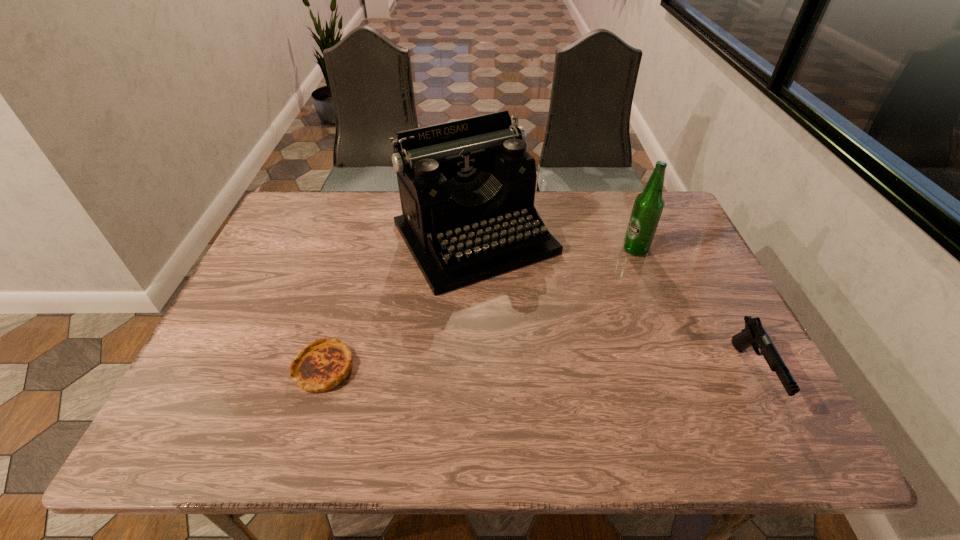
You are a GUI agent. You are given a task and a screenshot of the screen. Output one action in this format:
    pyautogui.click(x=<x>, y=<y>)
    Task: Click on the free space located on the label of the second object from right to left
    This screenshot has width=960, height=540.
    Given the screenshot: What is the action you would take?
    pyautogui.click(x=623, y=284)

Find the location of `vacant space located on the label of the second object from right to left`. vacant space located on the label of the second object from right to left is located at coordinates (623, 284).

Locate an element on the screen. The height and width of the screenshot is (540, 960). vacant space positioned on the label of the second object from right to left is located at coordinates (596, 360).

Image resolution: width=960 pixels, height=540 pixels. I want to click on object that is at the far edge, so click(467, 187).

Locate an element on the screen. quiche that is at the near edge is located at coordinates (323, 364).

Locate an element on the screen. The width and height of the screenshot is (960, 540). gun that is at the near edge is located at coordinates (754, 334).

Where is `gun positioned at the right edge`? The height and width of the screenshot is (540, 960). gun positioned at the right edge is located at coordinates (754, 334).

I want to click on beer bottle that is positioned at the right edge, so click(648, 206).

You are a GUI agent. You are given a task and a screenshot of the screen. Output one action in this format:
    pyautogui.click(x=<x>, y=<y>)
    Task: Click on the object present at the near right corner
    Image resolution: width=960 pixels, height=540 pixels.
    Given the screenshot: What is the action you would take?
    pyautogui.click(x=754, y=334)

The image size is (960, 540). In order to click on vacant space at the far edge of the desktop in this screenshot , I will do `click(367, 212)`.